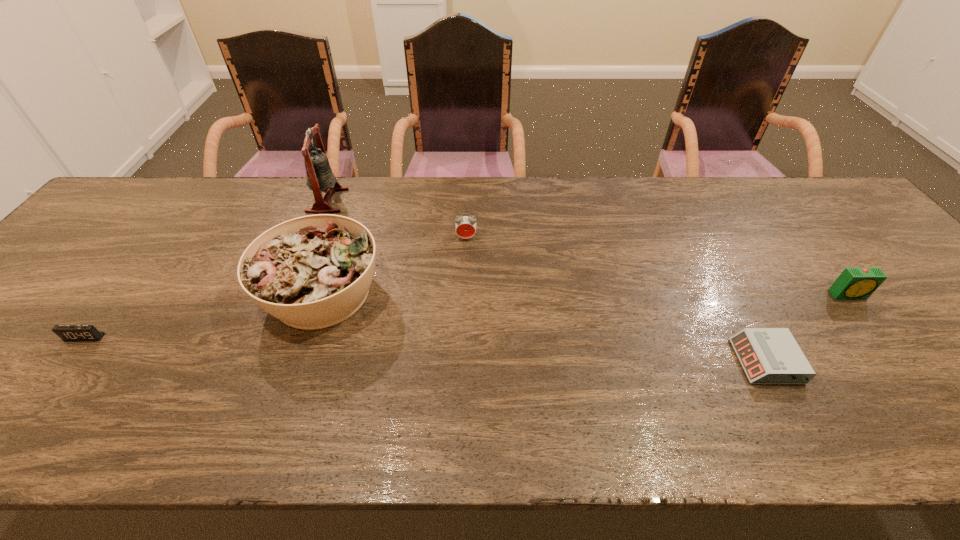
Locate an element on the screen. The height and width of the screenshot is (540, 960). blank space at the far left corner of the desktop is located at coordinates (101, 224).

You are a GUI agent. You are given a task and a screenshot of the screen. Output one action in this format:
    pyautogui.click(x=<x>, y=<y>)
    Task: Click on the free space between the tallest object and the second alarm clock from right to left
    
    Given the screenshot: What is the action you would take?
    pyautogui.click(x=546, y=281)

Identify the location of free spot between the fifth shortest object and the leftmost object. The height and width of the screenshot is (540, 960). (204, 315).

You are a GUI agent. You are given a task and a screenshot of the screen. Output one action in this format:
    pyautogui.click(x=<x>, y=<y>)
    Task: Click on the vacant space in between the bell and the fourth object from left to right
    
    Given the screenshot: What is the action you would take?
    pyautogui.click(x=396, y=219)

Where is `vacant space that's between the bell and the third object from right to left`? The height and width of the screenshot is (540, 960). vacant space that's between the bell and the third object from right to left is located at coordinates (396, 219).

Where is `free spot between the fifth object from left to right and the leftmost alarm clock`? free spot between the fifth object from left to right and the leftmost alarm clock is located at coordinates (425, 349).

Find the location of a particular element. This screenshot has width=960, height=540. unoccupied position between the fifth object from left to right and the tallest object is located at coordinates (546, 281).

At what (x,y) coordinates should I click in order to perform the action: click on free space between the third object from right to left and the rightmost alarm clock. Please return your answer as a coordinate pair (x, y). Image resolution: width=960 pixels, height=540 pixels. Looking at the image, I should click on (658, 266).

This screenshot has width=960, height=540. Find the location of `free space that is in between the third nearest alarm clock and the fifth shortest object`. free space that is in between the third nearest alarm clock and the fifth shortest object is located at coordinates tap(586, 294).

The image size is (960, 540). I want to click on free area in between the farthest alarm clock and the rightmost alarm clock, so click(658, 266).